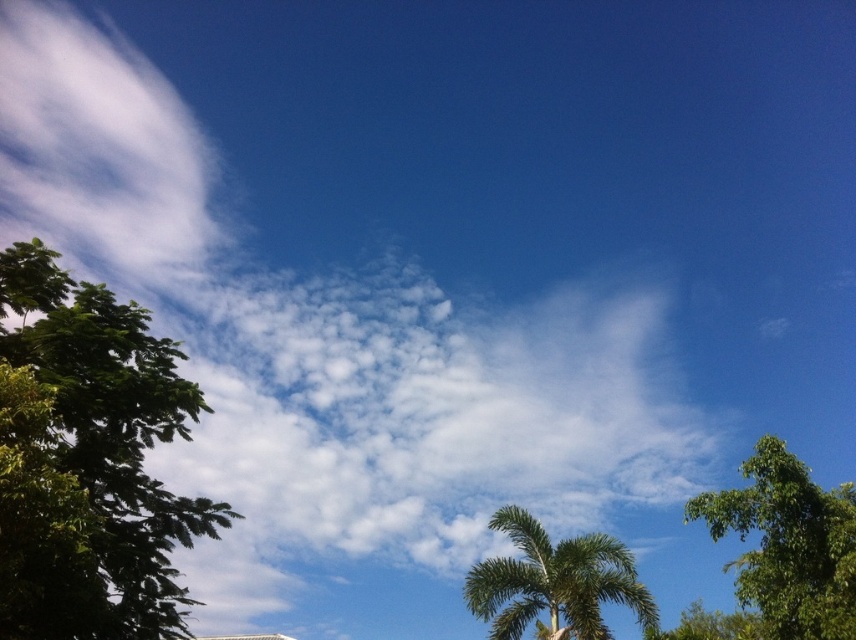
You are standing in the middle of a field looking at the green leafy tree at left and the green leafy tree at right. Which tree appears shorter?

The green leafy tree at left appears shorter because it is not as tall as the green leafy tree at right according to the description.

Based on the photo, you are planning to hang a birdhouse on one of the trees. The birdhouse requires a sturdy branch that can support its weight. Given the green leafy tree at left and the green leafy tree at right, which tree would you choose and why?

The green leafy tree at right is thicker than the green leafy tree at left, so it has sturdier branches capable of supporting the birdhouse better.